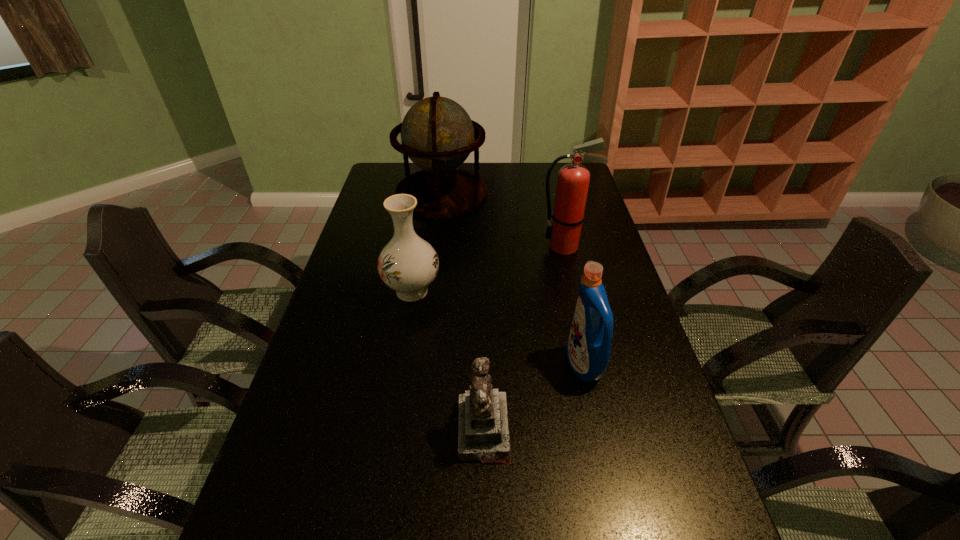
Where is `free space between the figurine and the farthest object`? The width and height of the screenshot is (960, 540). free space between the figurine and the farthest object is located at coordinates click(463, 312).

The height and width of the screenshot is (540, 960). What are the coordinates of `vacant region between the second farthest object and the detergent` in the screenshot? It's located at (574, 306).

Find the location of `object that is the closest to the detergent`. object that is the closest to the detergent is located at coordinates (483, 434).

Locate an element on the screen. the fourth closest object to the third farthest object is located at coordinates (588, 348).